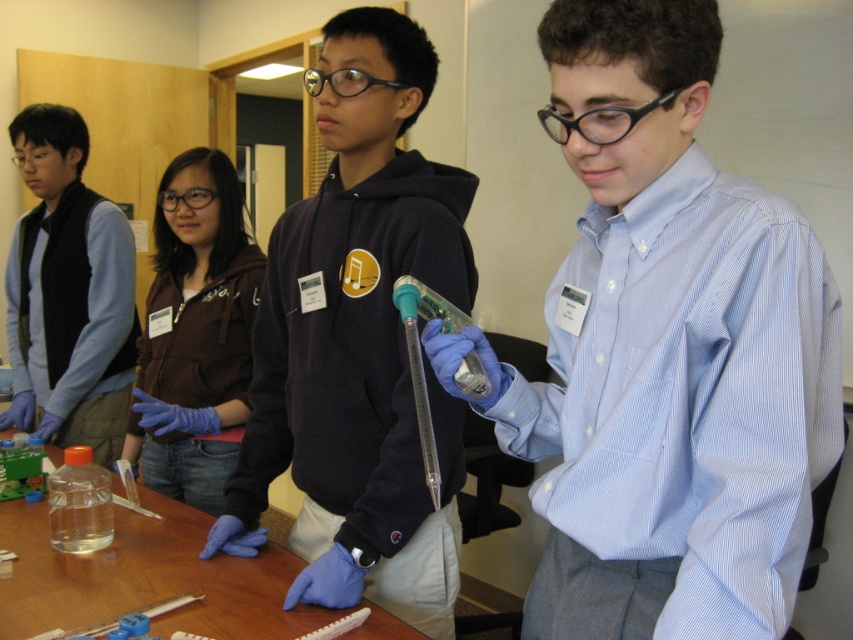
Question: Which object is the closest to the blue glossy shirt at center?

Choices:
 (A) matte blue vest at left
 (B) transparent plastic table at center

Answer: (B)

Question: Which object appears closest to the camera in this image?

Choices:
 (A) brown soft jacket at center
 (B) matte blue vest at left

Answer: (A)

Question: Which of the following is the closest to the observer?

Choices:
 (A) blue glossy shirt at center
 (B) transparent plastic table at center
 (C) matte blue vest at left
 (D) black matte hoodie at center

Answer: (A)

Question: Is blue glossy shirt at center to the left of brown soft jacket at center from the viewer's perspective?

Choices:
 (A) no
 (B) yes

Answer: (A)

Question: Does blue glossy shirt at center lie in front of black matte hoodie at center?

Choices:
 (A) yes
 (B) no

Answer: (A)

Question: Is black matte hoodie at center bigger than transparent plastic table at center?

Choices:
 (A) no
 (B) yes

Answer: (B)